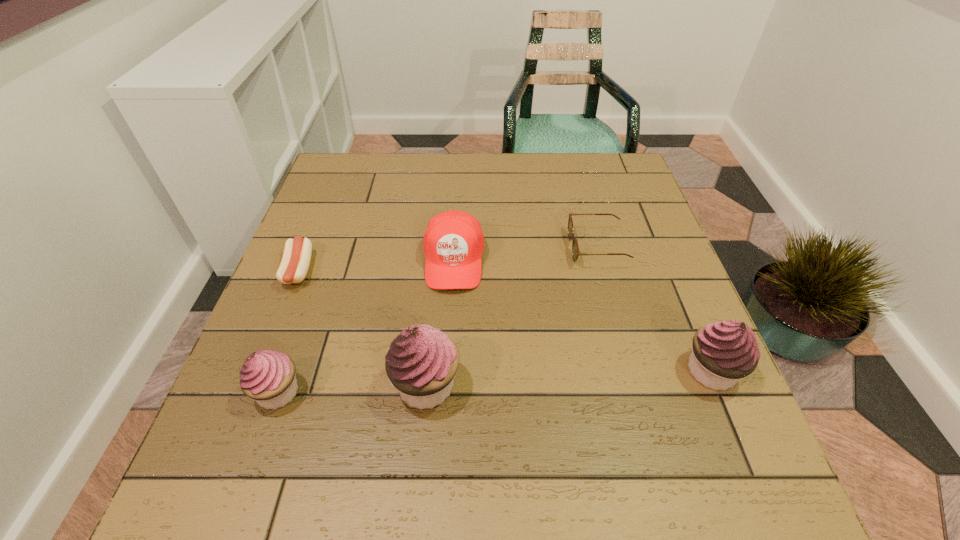
Locate an element on the screen. free space located at the front view of the second object from right to left is located at coordinates (440, 248).

The width and height of the screenshot is (960, 540). I want to click on free space located 0.140m at the front view of the second object from right to left, so click(x=514, y=248).

Locate an element on the screen. vacant space located 0.390m at the front view of the second object from right to left is located at coordinates (411, 248).

This screenshot has height=540, width=960. Find the location of `vacant space positioned 0.070m on the front panel of the fourth tallest object`. vacant space positioned 0.070m on the front panel of the fourth tallest object is located at coordinates (450, 320).

Identify the location of free region located on the right of the sausage. This screenshot has height=540, width=960. (361, 271).

Image resolution: width=960 pixels, height=540 pixels. Find the location of `cupcake situated at the left edge`. cupcake situated at the left edge is located at coordinates (268, 376).

You are a GUI agent. You are given a task and a screenshot of the screen. Output one action in this format:
    pyautogui.click(x=<x>, y=<y>)
    Task: Click on the sausage at the left edge
    The height and width of the screenshot is (540, 960).
    Given the screenshot: What is the action you would take?
    pyautogui.click(x=295, y=262)

The height and width of the screenshot is (540, 960). In order to click on cupcake that is positioned at the right edge in this screenshot , I will do `click(724, 352)`.

The image size is (960, 540). In order to click on spectacles located at the right edge in this screenshot , I will do `click(575, 249)`.

Identify the location of object that is at the near left corner. (268, 376).